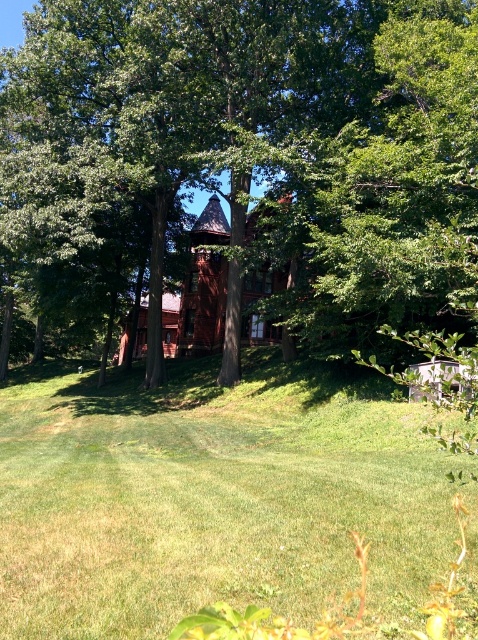
Question: Can you confirm if green leafy tree at center is positioned below red wood chapel at center?

Choices:
 (A) no
 (B) yes

Answer: (A)

Question: Can you confirm if green leafy tree at center is wider than green grass at center?

Choices:
 (A) yes
 (B) no

Answer: (A)

Question: Which of the following is the farthest from the observer?

Choices:
 (A) green leafy tree at center
 (B) green grass at center

Answer: (A)

Question: Which point appears closest to the camera in this image?

Choices:
 (A) (381, 515)
 (B) (405, 189)
 (C) (141, 300)

Answer: (A)

Question: Which point appears farthest from the camera in this image?

Choices:
 (A) (231, 275)
 (B) (275, 358)

Answer: (B)

Question: Is green leafy tree at center smaller than red wood chapel at center?

Choices:
 (A) yes
 (B) no

Answer: (B)